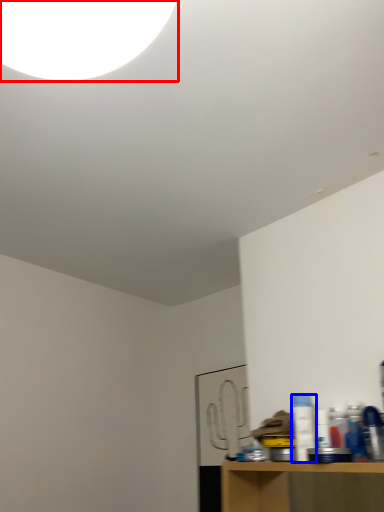
Question: Which of the following is the farthest to the observer, light (highlighted by a red box) or bottle (highlighted by a blue box)?

Choices:
 (A) light
 (B) bottle

Answer: (B)